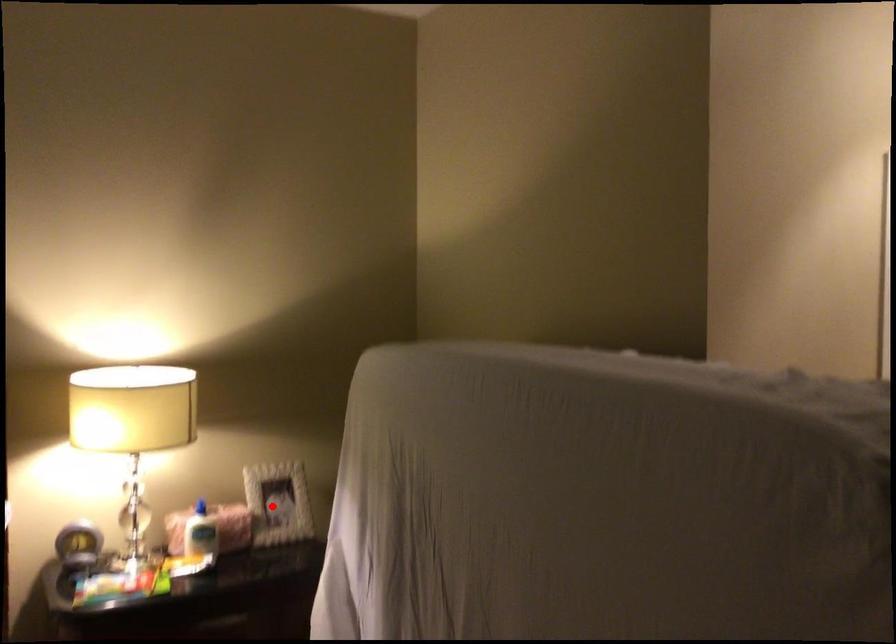
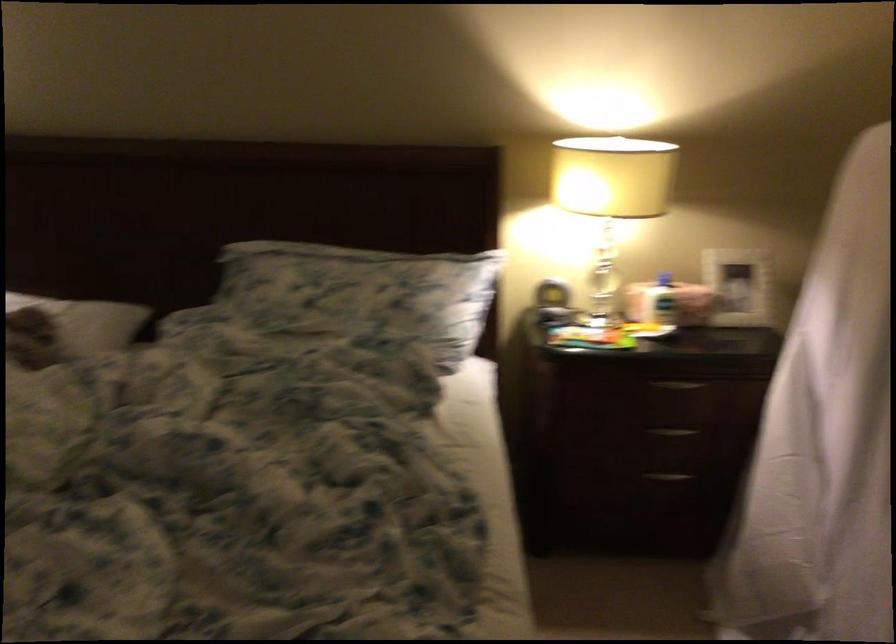
In the second image, find the point that corresponds to the highlighted location in the first image.

(737, 286)